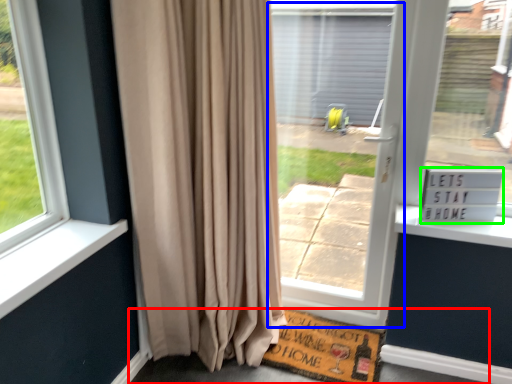
Question: Based on their relative distances, which object is nearer to pavement (highlighted by a red box)? Choose from screen door (highlighted by a blue box) and plaque (highlighted by a green box).

Choices:
 (A) screen door
 (B) plaque

Answer: (A)